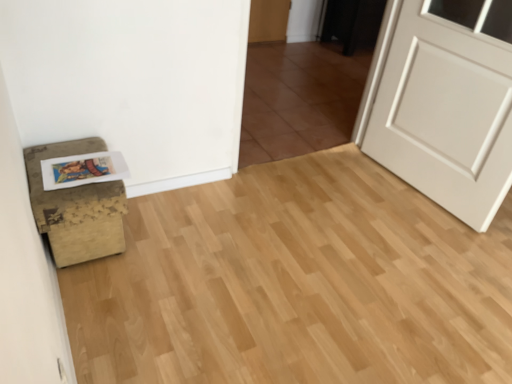
Locate an element on the screen. The width and height of the screenshot is (512, 384). vacant space in front of distressed brown ottoman at lower left is located at coordinates point(98,298).